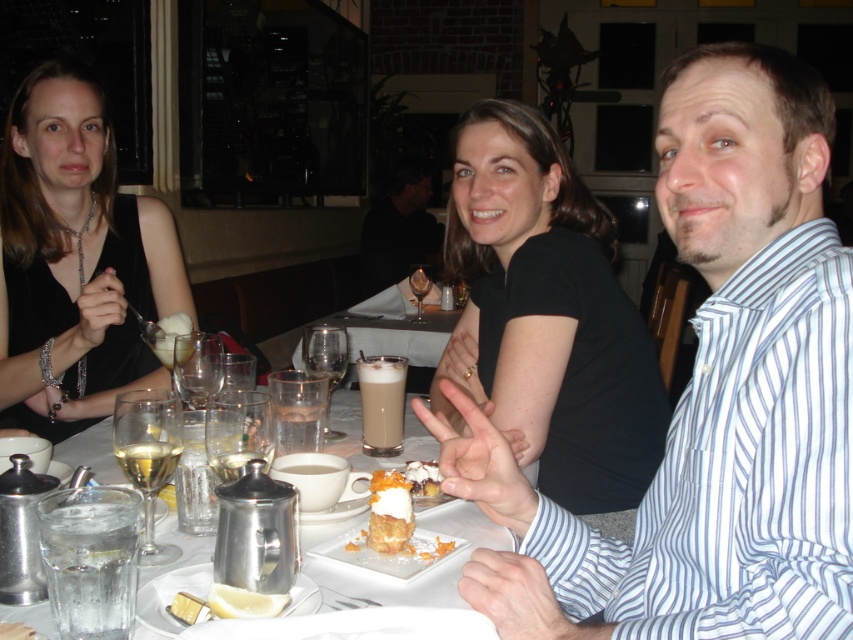
Is black matte shirt at center to the left of white porcelain plate at center from the viewer's perspective?

In fact, black matte shirt at center is to the right of white porcelain plate at center.

The width and height of the screenshot is (853, 640). What are the coordinates of `black matte shirt at center` in the screenshot? It's located at (547, 317).

Find the location of a particular element. The width and height of the screenshot is (853, 640). black matte shirt at center is located at coordinates (547, 317).

Does black satin dress at left have a larger size compared to translucent glass wine at center?

Actually, black satin dress at left might be smaller than translucent glass wine at center.

Between black satin dress at left and translucent glass wine at center, which one is positioned lower?

translucent glass wine at center

Between point (55, 70) and point (355, 353), which one is positioned in front?

Positioned in front is point (55, 70).

I want to click on black satin dress at left, so click(74, 260).

Between powdered white cake at center and yellow matte lemon at lower left, which one appears on the right side from the viewer's perspective?

powdered white cake at center

Does powdered white cake at center come behind yellow matte lemon at lower left?

Yes, it is.

Does point (444, 548) come farther from viewer compared to point (251, 596)?

Yes, point (444, 548) is farther from viewer.

Where is `powdered white cake at center`? The height and width of the screenshot is (640, 853). powdered white cake at center is located at coordinates (396, 515).